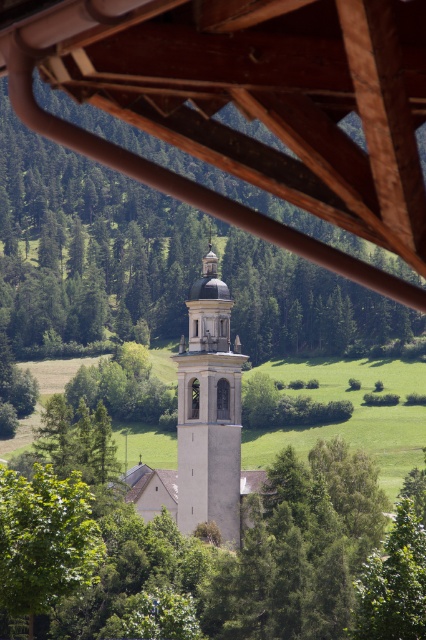
In the scene shown: You are standing in a rural area and see the green leafy tree at center and the white stone tower at center. Which one is taller?

The green leafy tree at center is taller than the white stone tower at center according to the description.

You are a photographer planning to capture a wide shot of the smooth white tower at center. You notice the green leafy tree at center might block the view. Based on their sizes, which object would appear bigger in the photo?

The green leafy tree at center would appear bigger in the photo since it has a larger size compared to the smooth white tower at center.

You are standing in the rural landscape and want to walk from the green leafy tree at lower left to the green leafy tree at center. Which direction should you head?

The green leafy tree at center is to the right of the green leafy tree at lower left, so you should head to the right.